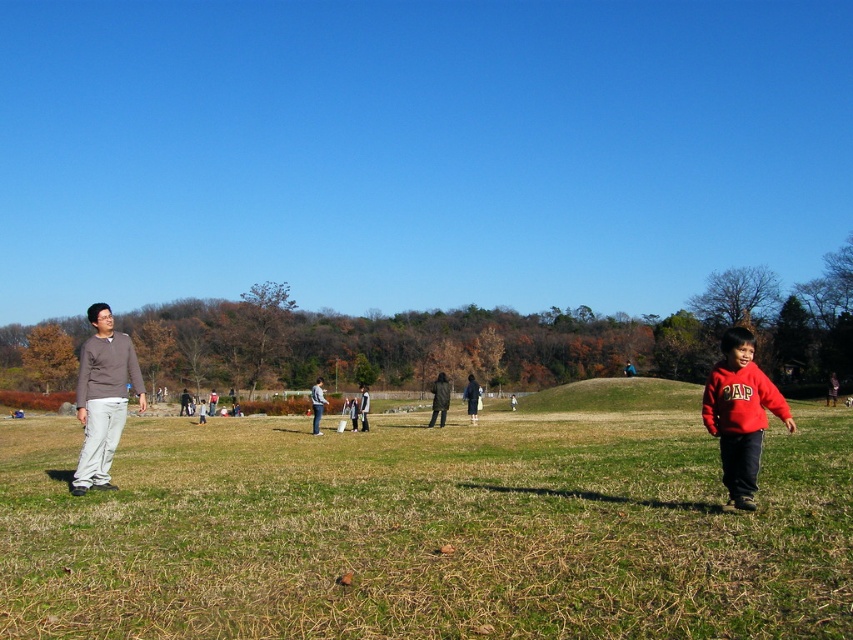
Measure the distance between point (90, 316) and camera.

A distance of 9.76 meters exists between point (90, 316) and camera.

Where is `brown cotton sweater at left`? brown cotton sweater at left is located at coordinates (103, 397).

You are a GUI agent. You are given a task and a screenshot of the screen. Output one action in this format:
    pyautogui.click(x=<x>, y=<y>)
    Task: Click on the brown cotton sweater at left
    This screenshot has height=640, width=853.
    Given the screenshot: What is the action you would take?
    pyautogui.click(x=103, y=397)

What do you see at coordinates (432, 525) in the screenshot? The height and width of the screenshot is (640, 853). I see `green grass at center` at bounding box center [432, 525].

Which is behind, point (346, 500) or point (131, 371)?

Positioned behind is point (131, 371).

The height and width of the screenshot is (640, 853). Identify the location of green grass at center. (432, 525).

Is dark gray jacket at center closer to camera compared to denim jacket at center?

That is False.

Does dark gray jacket at center appear on the right side of denim jacket at center?

Correct, you'll find dark gray jacket at center to the right of denim jacket at center.

Where is `dark gray jacket at center`? The height and width of the screenshot is (640, 853). dark gray jacket at center is located at coordinates (439, 400).

At what (x,y) coordinates should I click in order to perform the action: click on dark gray jacket at center. Please return your answer as a coordinate pair (x, y). The image size is (853, 640). Looking at the image, I should click on [x=439, y=400].